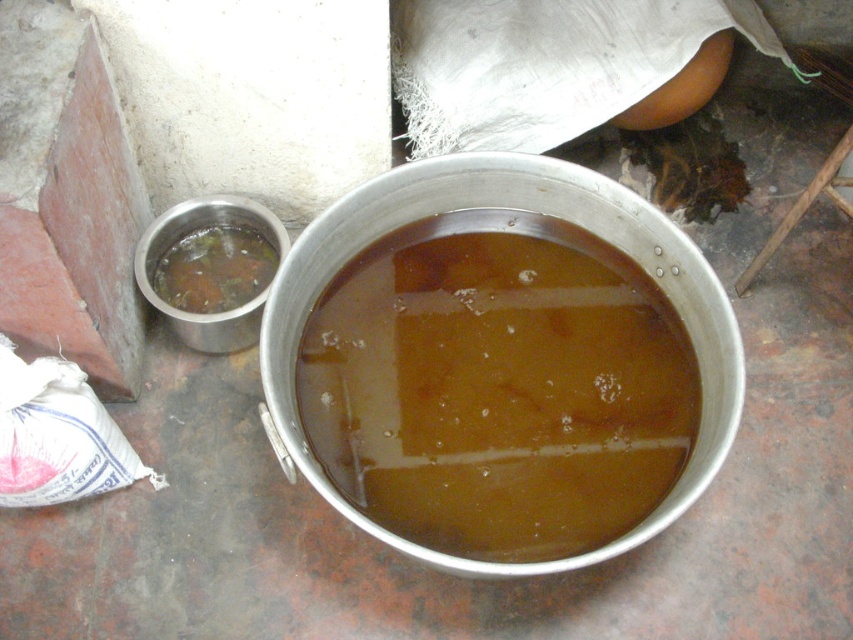
Who is positioned more to the right, brown liquid at center or brown liquid at lower left?

brown liquid at center

Based on the photo, does brown liquid at center come in front of brown liquid at lower left?

Yes, it is in front of brown liquid at lower left.

At what (x,y) coordinates should I click in order to perform the action: click on brown liquid at center. Please return your answer as a coordinate pair (x, y). This screenshot has height=640, width=853. Looking at the image, I should click on (498, 387).

Identify the location of brown liquid at center. [498, 387].